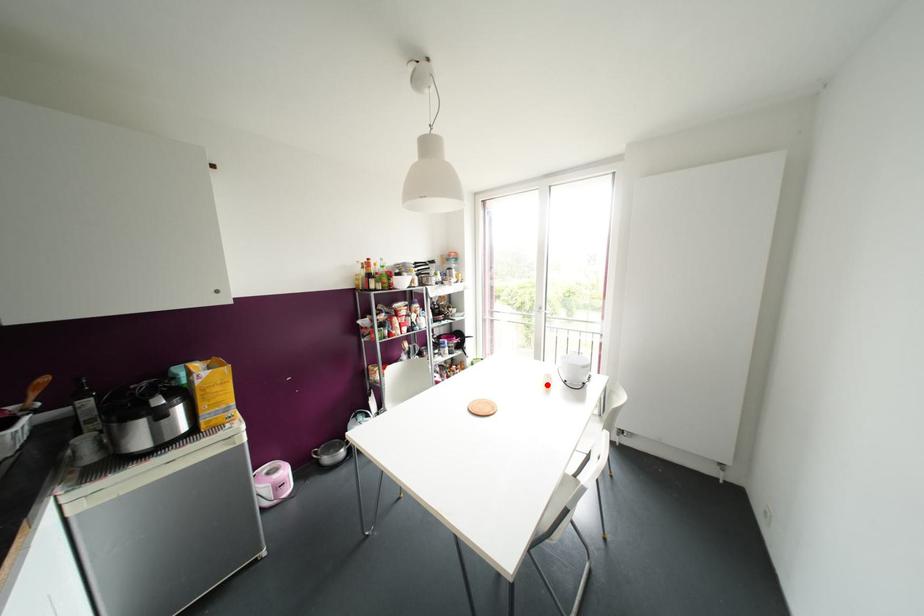
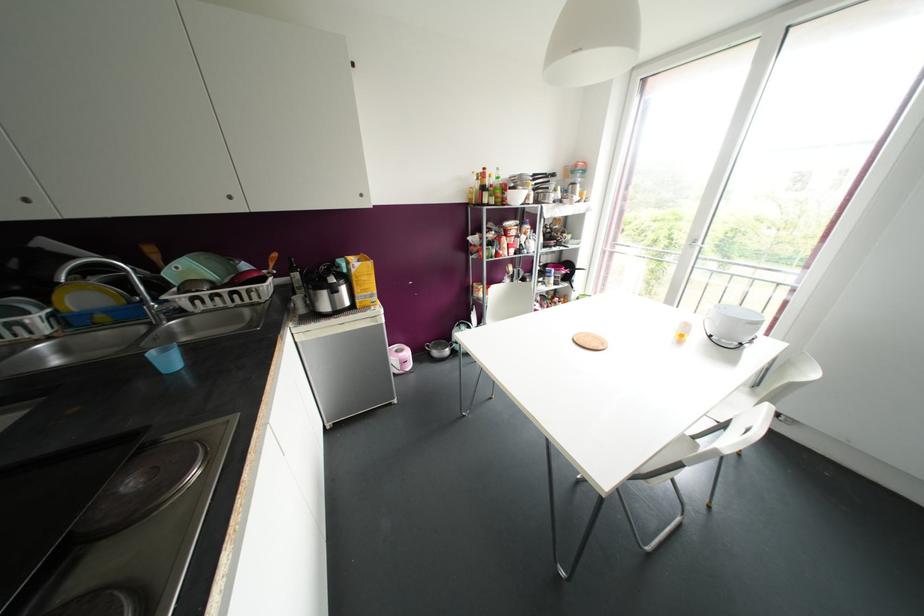
Where in the second image is the point corresponding to the highlighted location from the first image?

(681, 334)